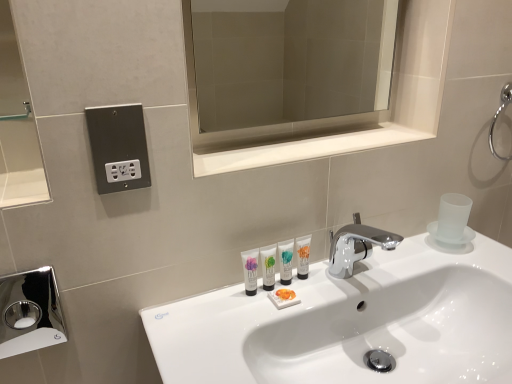
Question: Is white glossy tube at center, the first mouthwash in the left-to-right sequence, surrounding white glossy sink at center?

Choices:
 (A) no
 (B) yes

Answer: (A)

Question: Does white glossy tube at center, the first mouthwash in the left-to-right sequence, lie in front of white glossy sink at center?

Choices:
 (A) yes
 (B) no

Answer: (B)

Question: Is white glossy tube at center, the first mouthwash in the left-to-right sequence, to the right of white glossy sink at center from the viewer's perspective?

Choices:
 (A) no
 (B) yes

Answer: (A)

Question: Is white glossy tube at center, acting as the 4th mouthwash starting from the right, bigger than white glossy sink at center?

Choices:
 (A) yes
 (B) no

Answer: (B)

Question: Is white glossy tube at center, positioned as the first mouthwash in right-to-left order, bigger or smaller than metallic outlet at upper left?

Choices:
 (A) big
 (B) small

Answer: (B)

Question: Relative to metallic outlet at upper left, is white glossy tube at center, which ranks as the fourth mouthwash in left-to-right order, in front or behind?

Choices:
 (A) front
 (B) behind

Answer: (B)

Question: From a real-world perspective, relative to metallic outlet at upper left, is white glossy tube at center, which ranks as the fourth mouthwash in left-to-right order, vertically above or below?

Choices:
 (A) below
 (B) above

Answer: (A)

Question: Does point (297, 266) appear closer or farther from the camera than point (102, 152)?

Choices:
 (A) closer
 (B) farther

Answer: (B)

Question: Considering their positions, is white glossy tube at center, the 3th mouthwash in the left-to-right sequence, located in front of or behind white glossy tube at center, the first mouthwash in the left-to-right sequence?

Choices:
 (A) front
 (B) behind

Answer: (B)

Question: From their relative heights in the image, would you say white glossy tube at center, the 3th mouthwash in the left-to-right sequence, is taller or shorter than white glossy tube at center, the first mouthwash in the left-to-right sequence?

Choices:
 (A) short
 (B) tall

Answer: (A)

Question: From a real-world perspective, relative to white glossy tube at center, the first mouthwash in the left-to-right sequence, is white glossy tube at center, which is counted as the second mouthwash, starting from the right, vertically above or below?

Choices:
 (A) above
 (B) below

Answer: (B)

Question: Is point (290, 269) positioned closer to the camera than point (254, 286)?

Choices:
 (A) farther
 (B) closer

Answer: (A)

Question: Is white glossy tube at center, positioned as the first mouthwash in right-to-left order, to the left or to the right of white glossy tube at center, the first mouthwash in the left-to-right sequence, in the image?

Choices:
 (A) right
 (B) left

Answer: (A)

Question: From the image's perspective, is white glossy tube at center, which ranks as the fourth mouthwash in left-to-right order, positioned above or below white glossy tube at center, acting as the 4th mouthwash starting from the right?

Choices:
 (A) below
 (B) above

Answer: (B)